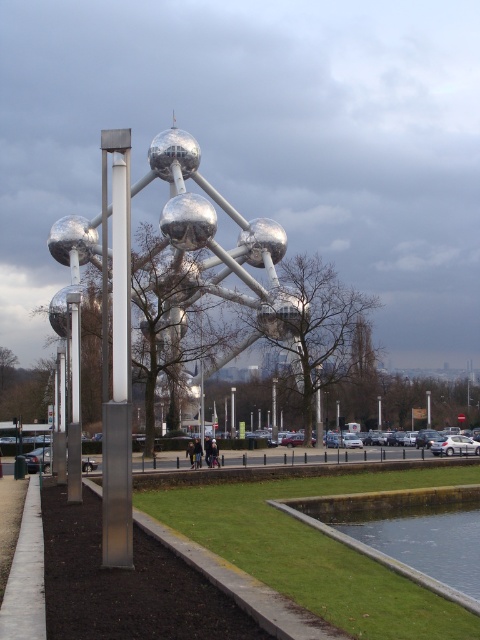
You are standing in front of the modern architectural structure and notice the silver polished pole at left and the clear water at lower center. Which object is positioned higher from the ground?

The silver polished pole at left is positioned higher from the ground than the clear water at lower center because it is above it.

You are a maintenance worker checking the height of the silver polished pole at left and the clear water at lower center. Which object has a greater height?

The silver polished pole at left is taller than the clear water at lower center.

You are standing at the center of the grassy area and want to find the clear water at lower center. According to the coordinates provided, in which direction should you walk from your current position to reach it?

The clear water at lower center is located at coordinates point (372, 547), so you should walk towards the lower center direction to reach it.